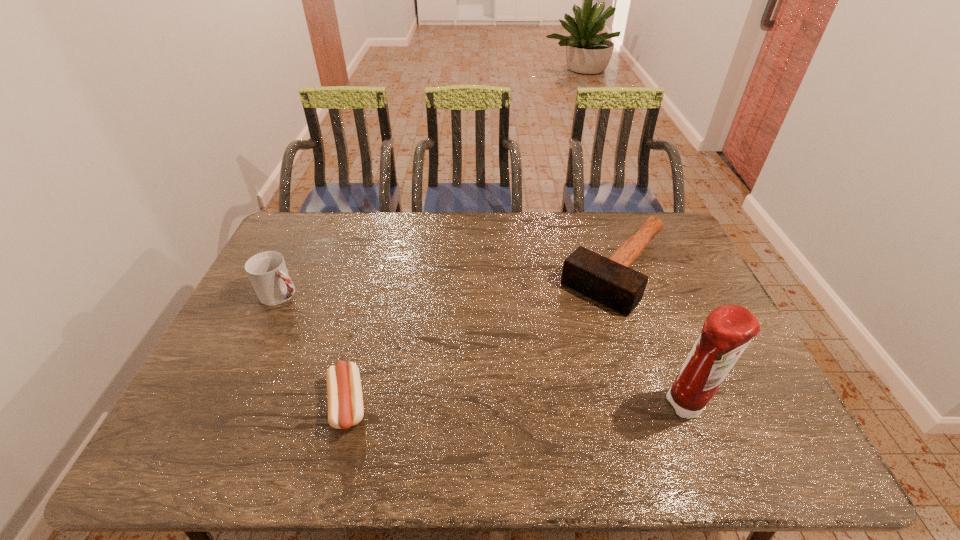
You are a GUI agent. You are given a task and a screenshot of the screen. Output one action in this format:
    pyautogui.click(x=<x>, y=<y>)
    Task: Click on the free space between the condiment and the leftmost object
    
    Given the screenshot: What is the action you would take?
    pyautogui.click(x=484, y=350)

Identify the location of vacant region between the mallet and the cup. Image resolution: width=960 pixels, height=540 pixels. (449, 282).

Image resolution: width=960 pixels, height=540 pixels. I want to click on free space between the second object from left to right and the mallet, so pos(482,338).

Find the location of a particular element. vacant area between the second object from left to right and the tallest object is located at coordinates (516, 406).

I want to click on blank region between the leftmost object and the shortest object, so [x=315, y=349].

Locate an element on the screen. The width and height of the screenshot is (960, 540). free point between the cup and the mallet is located at coordinates (449, 282).

Find the location of `unoccupied area between the tallest object and the cup`. unoccupied area between the tallest object and the cup is located at coordinates (484, 350).

You are a GUI agent. You are given a task and a screenshot of the screen. Output one action in this format:
    pyautogui.click(x=<x>, y=<y>)
    Task: Click on the free space between the leftmost object and the shortest object
    The width and height of the screenshot is (960, 540).
    Given the screenshot: What is the action you would take?
    pyautogui.click(x=315, y=349)

Where is `object that stands as the closest to the leftmost object`? object that stands as the closest to the leftmost object is located at coordinates (344, 392).

Point out which object is positioned as the third nearest to the leftmost object. Please provide its 2D coordinates. Your answer should be formatted as a tuple, i.e. [(x, y)], where the tuple contains the x and y coordinates of a point satisfying the conditions above.

[(727, 331)]